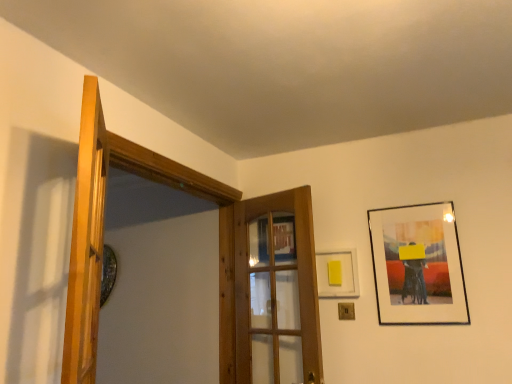
Question: From their relative heights in the image, would you say yellow matte picture frame at upper right, the first picture frame positioned from the left, is taller or shorter than wooden door at left, which is the first door in left-to-right order?

Choices:
 (A) short
 (B) tall

Answer: (A)

Question: From a real-world perspective, is yellow matte picture frame at upper right, the first picture frame positioned from the left, positioned above or below wooden door at left, the second door viewed from the back?

Choices:
 (A) above
 (B) below

Answer: (B)

Question: Which of these objects is positioned farthest from the wooden door at center, which is the first door from back to front?

Choices:
 (A) yellow matte picture frame at upper right, the first picture frame positioned from the left
 (B) wooden door at left, the second door viewed from the back
 (C) matte black picture frame at upper right, which is the first picture frame in right-to-left order

Answer: (B)

Question: Estimate the real-world distances between objects in this image. Which object is closer to the yellow matte picture frame at upper right, the first picture frame positioned from the left?

Choices:
 (A) wooden door at center, which is the first door from back to front
 (B) wooden door at left, which is the 1th door in front-to-back order
 (C) matte black picture frame at upper right, which is the first picture frame in right-to-left order

Answer: (C)